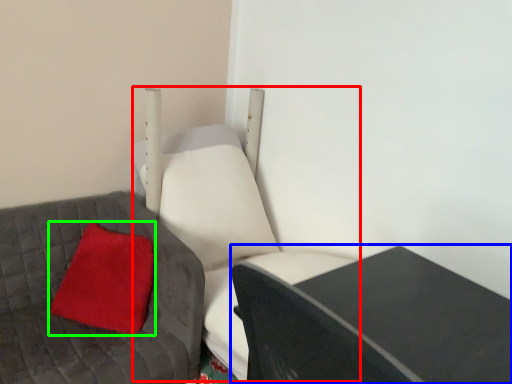
Question: Which object is the farthest from swivel chair (highlighted by a red box)? Choose among these: table (highlighted by a blue box) or pillow (highlighted by a green box).

Choices:
 (A) table
 (B) pillow

Answer: (A)